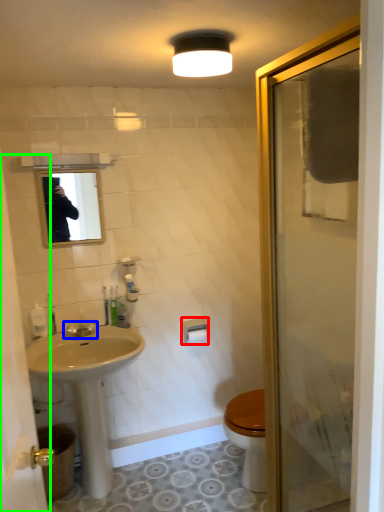
Question: Considering the real-world distances, which object is farthest from towel bar (highlighted by a red box)? tap (highlighted by a blue box) or screen door (highlighted by a green box)?

Choices:
 (A) tap
 (B) screen door

Answer: (B)